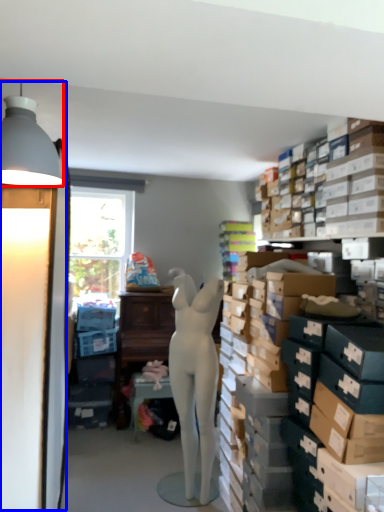
Question: Which point is further to the camera, lamp (highlighted by a red box) or table lamp (highlighted by a blue box)?

Choices:
 (A) lamp
 (B) table lamp

Answer: (B)